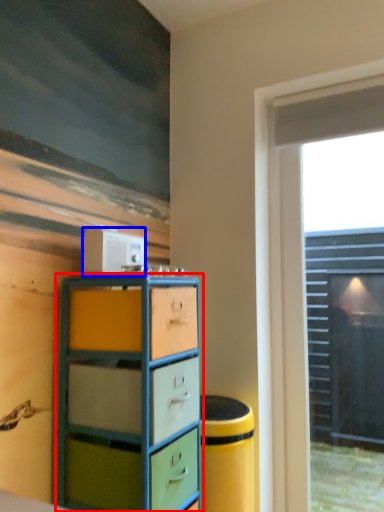
Question: Among these objects, which one is nearest to the camera, chest of drawers (highlighted by a red box) or appliance (highlighted by a blue box)?

Choices:
 (A) chest of drawers
 (B) appliance

Answer: (A)